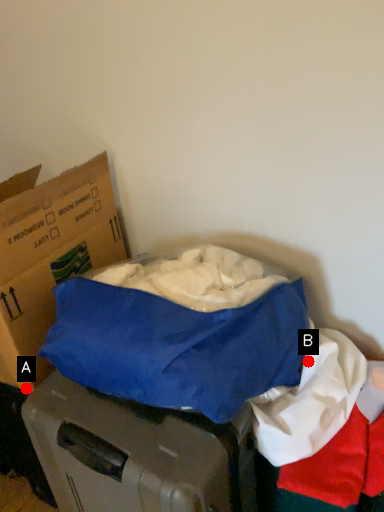
Question: Two points are circled on the image, labeled by A and B beside each circle. Which point is closer to the camera?

Choices:
 (A) A is closer
 (B) B is closer

Answer: (B)